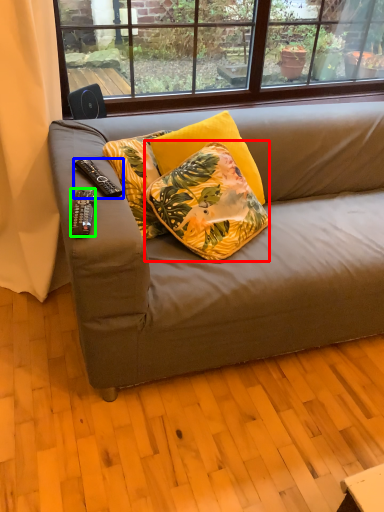
Question: Which object is the farthest from pillow (highlighted by a red box)? Choose among these: remote control (highlighted by a blue box) or remote control (highlighted by a green box).

Choices:
 (A) remote control
 (B) remote control

Answer: (B)